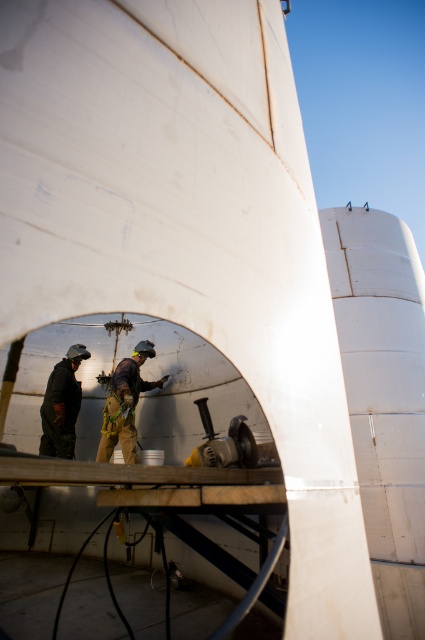
In the scene shown: Who is higher up, dark gray fabric shirt at left or metallic gray tool at center?

dark gray fabric shirt at left is higher up.

Can you confirm if dark gray fabric shirt at left is taller than metallic gray tool at center?

Correct, dark gray fabric shirt at left is much taller as metallic gray tool at center.

Describe the element at coordinates (62, 404) in the screenshot. I see `dark gray fabric shirt at left` at that location.

Locate an element on the screen. dark gray fabric shirt at left is located at coordinates (62, 404).

Is point (107, 422) farther from viewer compared to point (235, 454)?

That is True.

From the picture: Who is higher up, camouflage fabric workwear at center or metallic gray tool at center?

camouflage fabric workwear at center is higher up.

Is point (110, 400) positioned after point (238, 416)?

Yes, point (110, 400) is farther from viewer.

You are a GUI agent. You are given a task and a screenshot of the screen. Output one action in this format:
    pyautogui.click(x=<x>, y=<y>)
    Task: Click on the camouflage fabric workwear at center
    The height and width of the screenshot is (640, 425).
    Given the screenshot: What is the action you would take?
    pyautogui.click(x=124, y=404)

Measure the distance between camouflage fabric workwear at center and camera.

camouflage fabric workwear at center and camera are 15.50 feet apart.

Which is more to the left, camouflage fabric workwear at center or dark gray fabric shirt at left?

dark gray fabric shirt at left

The image size is (425, 640). Describe the element at coordinates (124, 404) in the screenshot. I see `camouflage fabric workwear at center` at that location.

The width and height of the screenshot is (425, 640). I want to click on camouflage fabric workwear at center, so click(x=124, y=404).